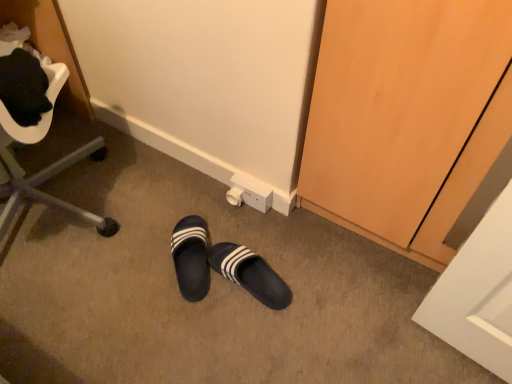
Describe the element at coordinates (42, 168) in the screenshot. I see `metallic silver chair at left` at that location.

In order to click on black rubber slippers at center in this screenshot , I will do `click(191, 257)`.

In order to face black leather slippers at center, should I rotate leftwards or rightwards?

Turn left approximately 0.815 degrees to face it.

What do you see at coordinates (222, 266) in the screenshot? I see `black leather slippers at center` at bounding box center [222, 266].

Where is `metallic silver chair at left`? Image resolution: width=512 pixels, height=384 pixels. metallic silver chair at left is located at coordinates (42, 168).

Does black rubber slippers at center have a smaller size compared to metallic silver chair at left?

Correct, black rubber slippers at center occupies less space than metallic silver chair at left.

In terms of width, does black rubber slippers at center look wider or thinner when compared to metallic silver chair at left?

Clearly, black rubber slippers at center has less width compared to metallic silver chair at left.

Considering the positions of objects black rubber slippers at center and metallic silver chair at left in the image provided, who is behind, black rubber slippers at center or metallic silver chair at left?

black rubber slippers at center.

Is black leather slippers at center thinner than black rubber slippers at center?

Correct, the width of black leather slippers at center is less than that of black rubber slippers at center.

Considering the sizes of objects black leather slippers at center and black rubber slippers at center in the image provided, who is bigger, black leather slippers at center or black rubber slippers at center?

black rubber slippers at center.

From the image's perspective, between black leather slippers at center and black rubber slippers at center, which one is located above?

black rubber slippers at center, from the image's perspective.

Is metallic silver chair at left far from black rubber slippers at center?

No, metallic silver chair at left is in close proximity to black rubber slippers at center.

Does metallic silver chair at left turn towards black rubber slippers at center?

No.

From a real-world perspective, does metallic silver chair at left stand above black rubber slippers at center?

Correct, in the physical world, metallic silver chair at left is higher than black rubber slippers at center.

Can you confirm if metallic silver chair at left is smaller than black rubber slippers at center?

Actually, metallic silver chair at left might be larger than black rubber slippers at center.

Can you tell me how much metallic silver chair at left and black leather slippers at center differ in facing direction?

The angle between the facing direction of metallic silver chair at left and the facing direction of black leather slippers at center is 148 degrees.

From a real-world perspective, is metallic silver chair at left positioned over black leather slippers at center based on gravity?

Correct, in the physical world, metallic silver chair at left is higher than black leather slippers at center.

At what (x,y) coordinates should I click in order to perform the action: click on leather shoe below the metallic silver chair at left (from a real-world perspective). Please return your answer as a coordinate pair (x, y). This screenshot has height=384, width=512. Looking at the image, I should click on (222, 266).

Consider the image. Is metallic silver chair at left facing towards black leather slippers at center?

No, metallic silver chair at left is not aimed at black leather slippers at center.

Can you confirm if black leather slippers at center is shorter than metallic silver chair at left?

Indeed, black leather slippers at center has a lesser height compared to metallic silver chair at left.

Is black leather slippers at center inside the boundaries of metallic silver chair at left, or outside?

black leather slippers at center is outside metallic silver chair at left.

Considering the relative sizes of black leather slippers at center and metallic silver chair at left in the image provided, is black leather slippers at center thinner than metallic silver chair at left?

Correct, the width of black leather slippers at center is less than that of metallic silver chair at left.

Considering the sizes of objects black leather slippers at center and metallic silver chair at left in the image provided, who is smaller, black leather slippers at center or metallic silver chair at left?

With smaller size is black leather slippers at center.

Does point (177, 243) come in front of point (226, 246)?

Yes, it is.

Which of these two, black rubber slippers at center or black leather slippers at center, is thinner?

Thinner between the two is black leather slippers at center.

From the image's perspective, is black rubber slippers at center above or below black leather slippers at center?

From the image's perspective, black rubber slippers at center appears above black leather slippers at center.

From a real-world perspective, which is physically below, black rubber slippers at center or black leather slippers at center?

From a 3D spatial view, black rubber slippers at center is below.

Locate an element on the screen. Image resolution: width=512 pixels, height=384 pixels. furniture above the black rubber slippers at center (from a real-world perspective) is located at coordinates (42, 168).

Identify the location of footwear behind the black leather slippers at center. (191, 257).

In the scene shown: Considering their positions, is metallic silver chair at left positioned closer to black rubber slippers at center than black leather slippers at center?

black leather slippers at center is closer to black rubber slippers at center.

When comparing their distances from metallic silver chair at left, does black leather slippers at center or black rubber slippers at center seem closer?

black leather slippers at center.

Considering their positions, is metallic silver chair at left positioned closer to black leather slippers at center than black rubber slippers at center?

black rubber slippers at center is positioned closer to the anchor black leather slippers at center.

When comparing their distances from metallic silver chair at left, does black rubber slippers at center or black leather slippers at center seem further?

Based on the image, black rubber slippers at center appears to be further to metallic silver chair at left.

Estimate the real-world distances between objects in this image. Which object is closer to black leather slippers at center, black rubber slippers at center or metallic silver chair at left?

The object closer to black leather slippers at center is black rubber slippers at center.

Consider the image. Based on their spatial positions, is black leather slippers at center or metallic silver chair at left closer to black rubber slippers at center?

black leather slippers at center lies closer to black rubber slippers at center than the other object.

Image resolution: width=512 pixels, height=384 pixels. Identify the location of footwear between metallic silver chair at left and black leather slippers at center. (191, 257).